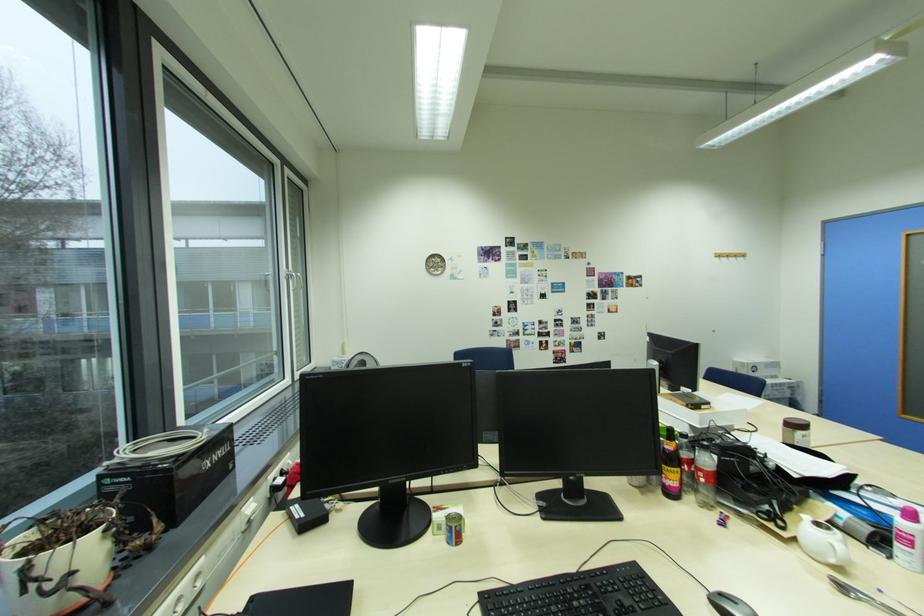
Find the location of `silver window handle`. silver window handle is located at coordinates (292, 280).